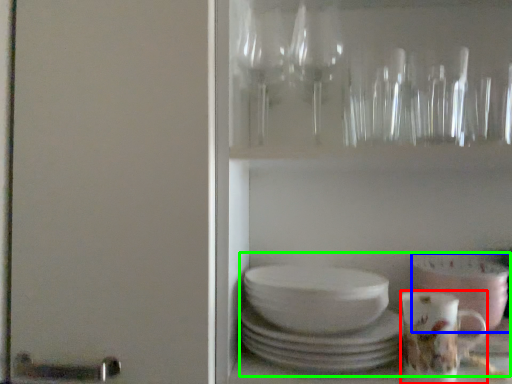
Question: Which object is the closest to the coffee cup (highlighted by a red box)? Choose among these: bowl (highlighted by a blue box) or tea set (highlighted by a green box).

Choices:
 (A) bowl
 (B) tea set

Answer: (A)